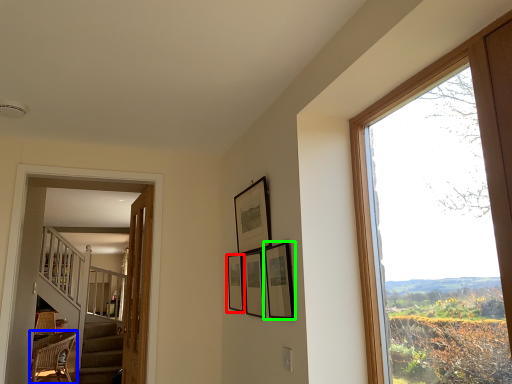
Question: Based on their relative distances, which object is nearer to picture frame (highlighted by a red box)? Choose from chair (highlighted by a blue box) and picture frame (highlighted by a green box).

Choices:
 (A) chair
 (B) picture frame

Answer: (B)